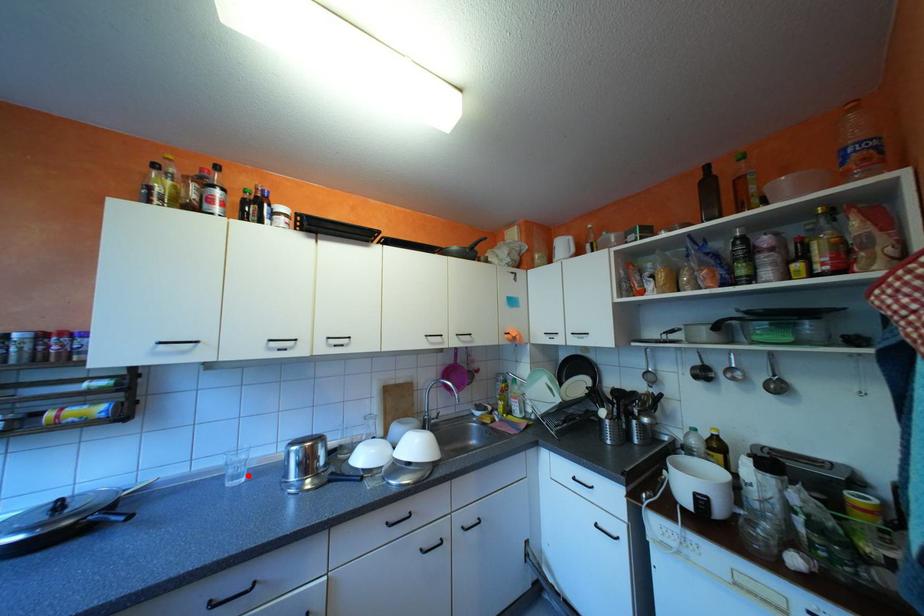
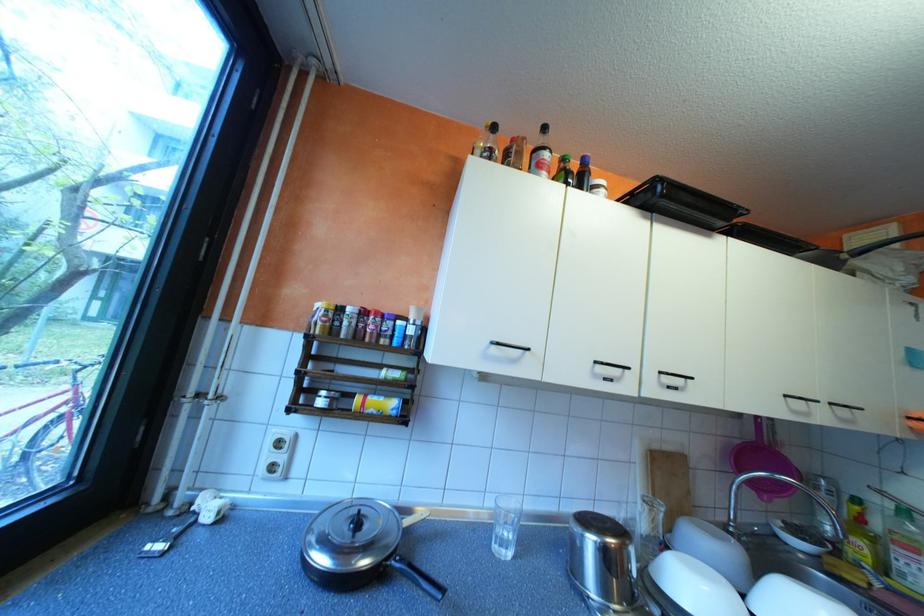
In the second image, find the point that corresponds to the highlighted location in the first image.

(515, 541)